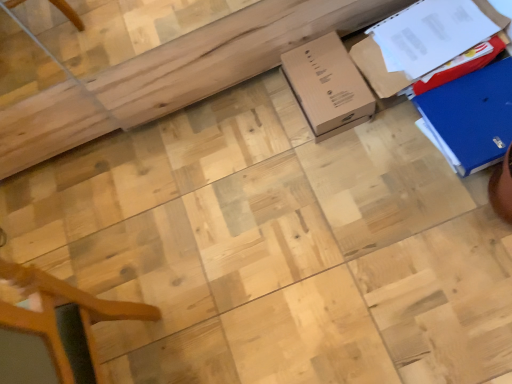
Question: Can brown cardboard box at upper right, the second cardboard box in the right-to-left sequence, be found inside brown cardboard box at center, which appears as the 3th cardboard box when viewed from the right?

Choices:
 (A) yes
 (B) no

Answer: (B)

Question: Is brown cardboard box at center, which appears as the 3th cardboard box when viewed from the right, beside brown cardboard box at upper right, which is the second cardboard box in left-to-right order?

Choices:
 (A) no
 (B) yes

Answer: (A)

Question: From the image's perspective, does brown cardboard box at center, which appears as the 3th cardboard box when viewed from the right, appear lower than brown cardboard box at upper right, the second cardboard box in the right-to-left sequence?

Choices:
 (A) no
 (B) yes

Answer: (B)

Question: Is brown cardboard box at center, which appears as the 3th cardboard box when viewed from the right, behind brown cardboard box at upper right, the second cardboard box in the right-to-left sequence?

Choices:
 (A) yes
 (B) no

Answer: (A)

Question: Does brown cardboard box at center, the 1th cardboard box positioned from the left, have a larger size compared to brown cardboard box at upper right, the second cardboard box in the right-to-left sequence?

Choices:
 (A) no
 (B) yes

Answer: (A)

Question: Considering the positions of blue cardboard box at right, which is the first cardboard box from right to left, and brown cardboard box at upper right, the second cardboard box in the right-to-left sequence, in the image, is blue cardboard box at right, which is the first cardboard box from right to left, bigger or smaller than brown cardboard box at upper right, the second cardboard box in the right-to-left sequence,?

Choices:
 (A) big
 (B) small

Answer: (B)

Question: Relative to brown cardboard box at upper right, which is the second cardboard box in left-to-right order, is blue cardboard box at right, the third cardboard box viewed from the left, in front or behind?

Choices:
 (A) behind
 (B) front

Answer: (B)

Question: Does point (477, 87) appear closer or farther from the camera than point (406, 79)?

Choices:
 (A) farther
 (B) closer

Answer: (B)

Question: Considering the relative positions of blue cardboard box at right, the third cardboard box viewed from the left, and brown cardboard box at upper right, the second cardboard box in the right-to-left sequence, in the image provided, is blue cardboard box at right, the third cardboard box viewed from the left, to the left or to the right of brown cardboard box at upper right, the second cardboard box in the right-to-left sequence,?

Choices:
 (A) left
 (B) right

Answer: (B)

Question: Considering the relative positions of brown cardboard box at upper right, the second cardboard box in the right-to-left sequence, and brown cardboard box at center, which appears as the 3th cardboard box when viewed from the right, in the image provided, is brown cardboard box at upper right, the second cardboard box in the right-to-left sequence, to the left or to the right of brown cardboard box at center, which appears as the 3th cardboard box when viewed from the right,?

Choices:
 (A) left
 (B) right

Answer: (B)

Question: Looking at their shapes, would you say brown cardboard box at upper right, the second cardboard box in the right-to-left sequence, is wider or thinner than brown cardboard box at center, the 1th cardboard box positioned from the left?

Choices:
 (A) thin
 (B) wide

Answer: (B)

Question: In terms of height, does brown cardboard box at upper right, the second cardboard box in the right-to-left sequence, look taller or shorter compared to brown cardboard box at center, which appears as the 3th cardboard box when viewed from the right?

Choices:
 (A) tall
 (B) short

Answer: (A)

Question: Does point (495, 16) appear closer or farther from the camera than point (303, 82)?

Choices:
 (A) farther
 (B) closer

Answer: (B)

Question: Is brown cardboard box at upper right, the second cardboard box in the right-to-left sequence, to the left or to the right of blue cardboard box at right, the third cardboard box viewed from the left, in the image?

Choices:
 (A) right
 (B) left

Answer: (B)

Question: Looking at the image, does brown cardboard box at upper right, which is the second cardboard box in left-to-right order, seem bigger or smaller compared to blue cardboard box at right, which is the first cardboard box from right to left?

Choices:
 (A) big
 (B) small

Answer: (A)